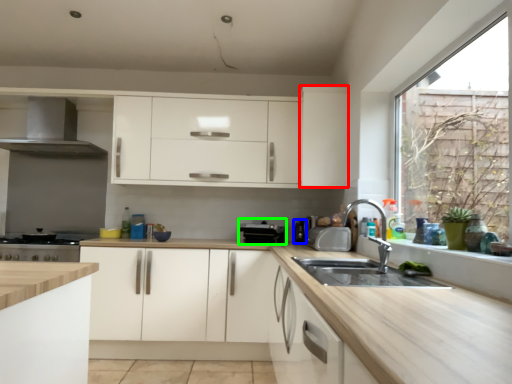
Question: Which is nearer to the cabinetry (highlighted by a red box)? appliance (highlighted by a blue box) or appliance (highlighted by a green box).

Choices:
 (A) appliance
 (B) appliance

Answer: (B)